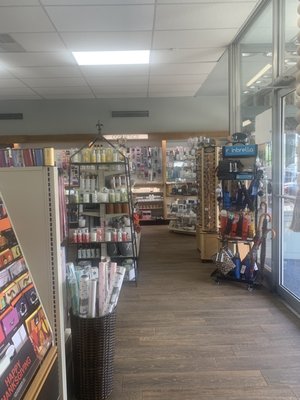
Identify the location of window. This screenshot has height=400, width=300. [x=259, y=91].